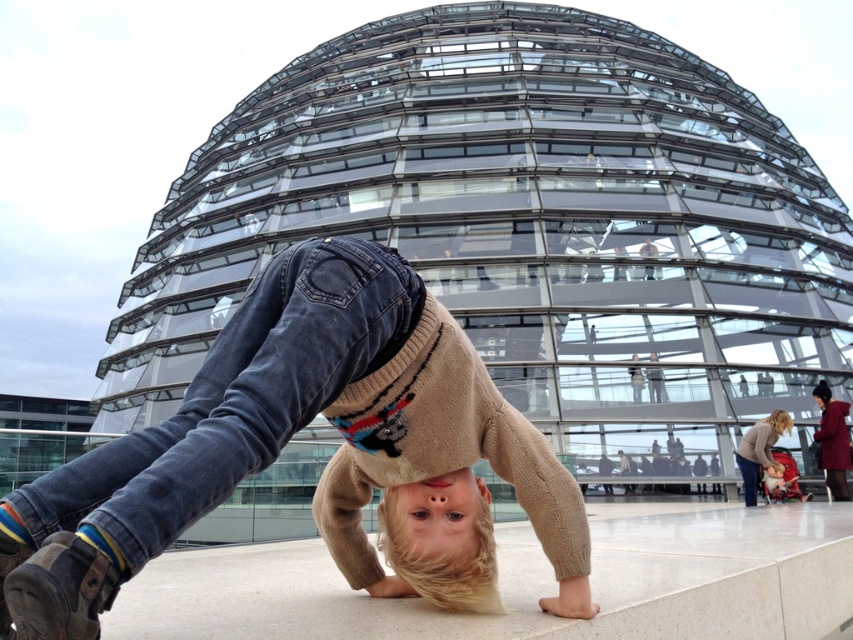
You are a photographer trying to capture both the knitted sweater at center and the light brown sweater at lower right in the same frame. Given that your camera has a maximum zoom range of 10 meters, can you fit both objects into the photo without moving closer?

The knitted sweater at center and light brown sweater at lower right are 26.53 meters apart from each other, which exceeds the camera maximum zoom range of 10 meters. Therefore, you cannot fit both objects into the photo without moving closer.

You are a photographer trying to capture the child in the handstand. You notice the blonde hair at center and the light brown sweater at lower right. Which object is covering the other?

The blonde hair at center is positioned over light brown sweater at lower right, so the hair is covering the sweater.